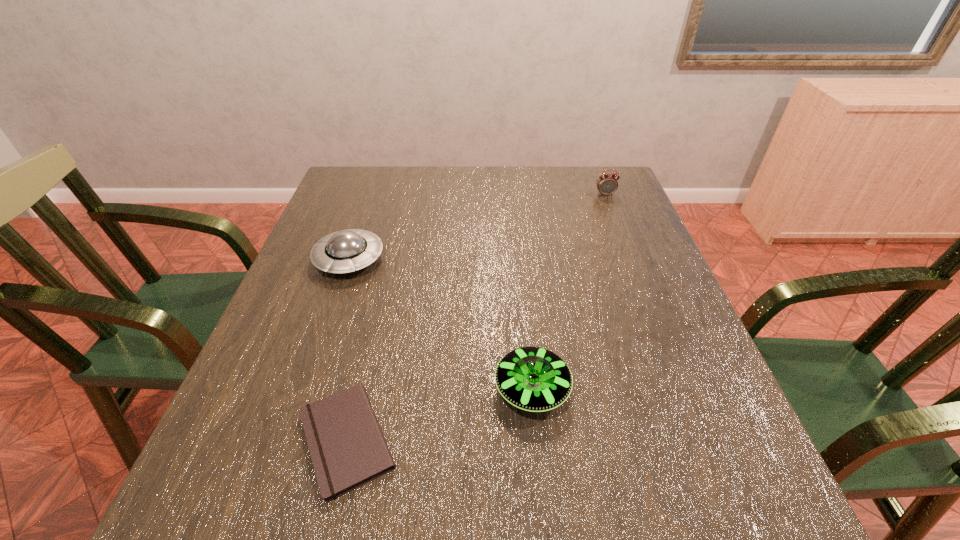
Locate an element on the screen. This screenshot has width=960, height=540. vacant space at the left edge of the desktop is located at coordinates (261, 470).

Locate an element on the screen. The image size is (960, 540). free space at the right edge of the desktop is located at coordinates (636, 382).

The image size is (960, 540). Find the location of `vacant space at the far left corner of the desktop`. vacant space at the far left corner of the desktop is located at coordinates (390, 181).

You are a GUI agent. You are given a task and a screenshot of the screen. Output one action in this format:
    pyautogui.click(x=<x>, y=<y>)
    Task: Click on the free space at the near right corner of the desktop
    This screenshot has width=960, height=540.
    Given the screenshot: What is the action you would take?
    pyautogui.click(x=724, y=492)

What are the coordinates of `free area in between the checkbook and the second object from right to left` in the screenshot? It's located at (440, 414).

Image resolution: width=960 pixels, height=540 pixels. I want to click on vacant space in between the farther saucer and the rightmost object, so click(x=477, y=227).

Image resolution: width=960 pixels, height=540 pixels. I want to click on vacant area between the rightmost object and the second object from right to left, so click(x=568, y=292).

This screenshot has width=960, height=540. I want to click on vacant space in between the alarm clock and the right saucer, so click(568, 292).

Where is `free area in between the alarm clock and the checkbook`? free area in between the alarm clock and the checkbook is located at coordinates (476, 317).

This screenshot has width=960, height=540. Identify the location of free space that is in between the nearer saucer and the farther saucer. (441, 324).